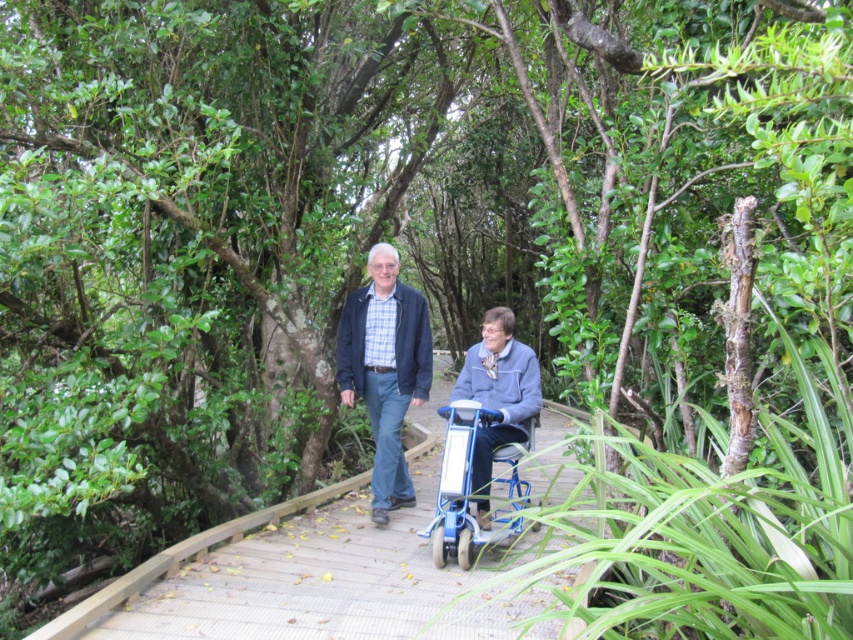
You are a photographer planning to take a picture of the wooden walkway at center and the blue plaid shirt at center. Based on their positions, which object should appear lower in the photo?

The wooden walkway at center is located below blue plaid shirt at center, so it will appear lower in the photo.

You are a maintenance worker inspecting the wooden walkway at center and the blue metallic walker at center. Which object has a lower height?

The wooden walkway at center is not as tall as the blue metallic walker at center, so the wooden walkway at center has a lower height.

You are a delivery person trying to deliver a package to the woman on the blue plaid shirt at center. The wooden walkway at center is narrow. Can you pass through the walkway to reach her?

The wooden walkway at center has a lesser width compared to blue plaid shirt at center, meaning the walkway is narrower than the shirt. However, the shirt width is not indicative of the scooter or the path needed. Since the scooter is on the walkway, it must fit. Proceed carefully.